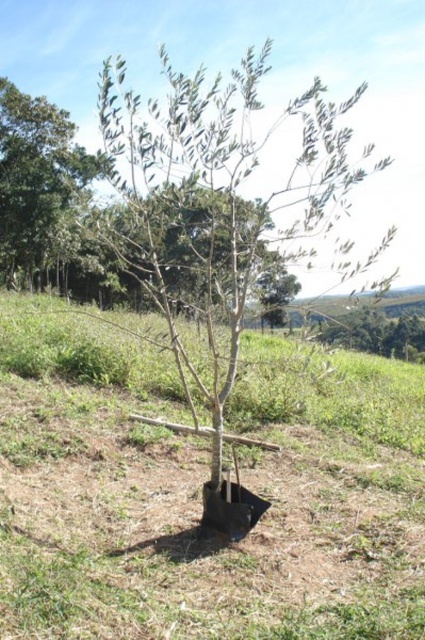
Question: Which of the following is the closest to the observer?

Choices:
 (A) green matte tree at center
 (B) green grass at center
 (C) green leafy tree at upper left

Answer: (B)

Question: Which of the following is the farthest from the observer?

Choices:
 (A) (363, 433)
 (B) (78, 177)
 (C) (129, 104)

Answer: (B)

Question: Does green grass at center appear under green leafy tree at upper left?

Choices:
 (A) yes
 (B) no

Answer: (A)

Question: Does green matte tree at center appear on the right side of green leafy tree at upper left?

Choices:
 (A) no
 (B) yes

Answer: (B)

Question: Which object appears farthest from the camera in this image?

Choices:
 (A) green leafy tree at upper left
 (B) green matte tree at center
 (C) green grass at center

Answer: (A)

Question: Does green matte tree at center come in front of green leafy tree at upper left?

Choices:
 (A) yes
 (B) no

Answer: (A)